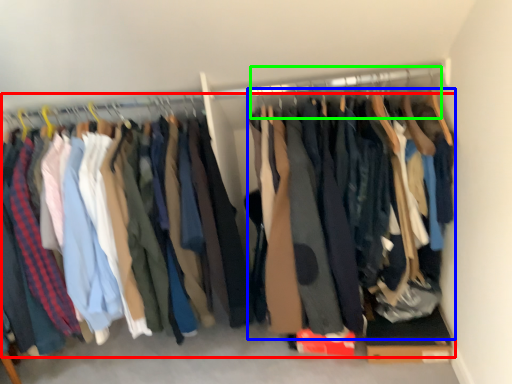
Question: Which object is the farthest from trousers (highlighted by a red box)? Choose among these: clothing (highlighted by a blue box) or hanger (highlighted by a green box).

Choices:
 (A) clothing
 (B) hanger

Answer: (B)